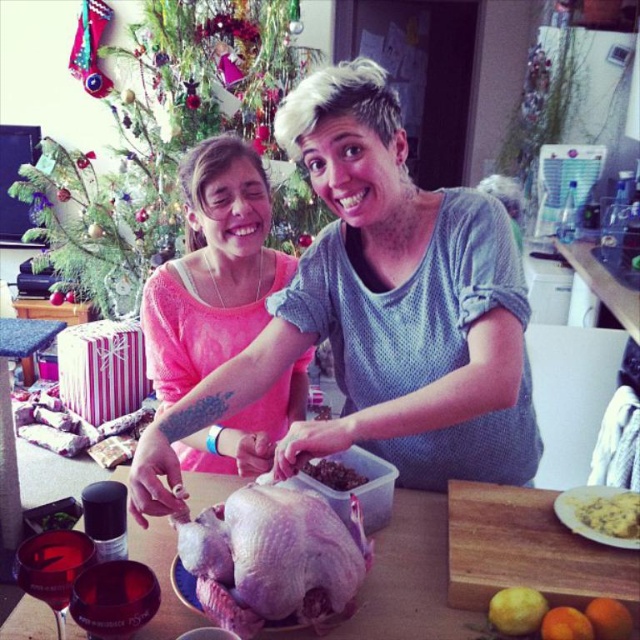
You are a photographer taking a picture of two people in a kitchen. You see the pink matte shirt at upper left and the pink matte sweater at center. Which one is more to the left?

The pink matte sweater at center is more to the left because the pink matte shirt at upper left is positioned on the right side of it.

You are organizing a closet and see the pink matte shirt at upper left and the pink matte sweater at center. Which item is located below the other?

The pink matte shirt at upper left is positioned under the pink matte sweater at center, meaning the shirt is below the sweater.